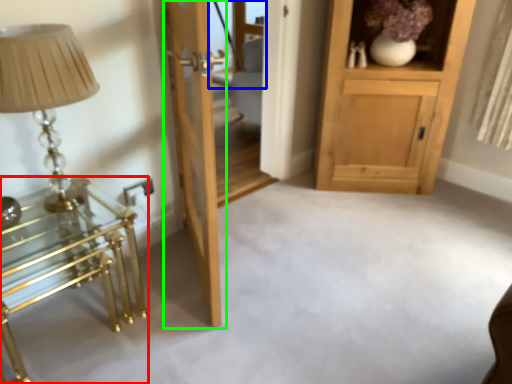
Question: Which is farther away from table (highlighted by a red box)? glass door (highlighted by a blue box) or door (highlighted by a green box)?

Choices:
 (A) glass door
 (B) door

Answer: (A)